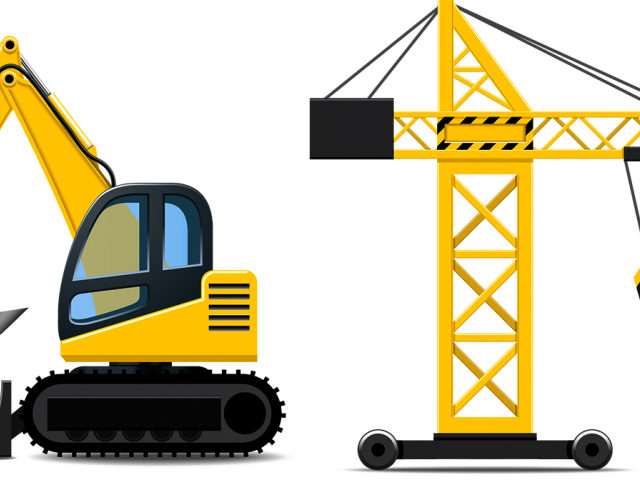
This screenshot has height=480, width=640. What are the coordinates of `windows` in the screenshot? It's located at (191, 231), (127, 244), (116, 308).